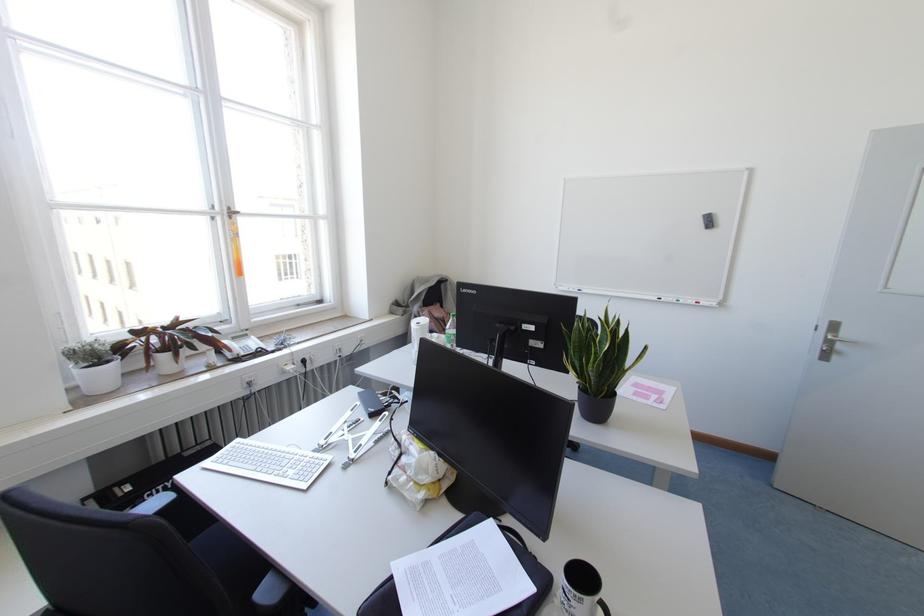
Find where to sit the black chair sitting surface. Please return your answer as a coordinate pair (x, y).

(204, 538)